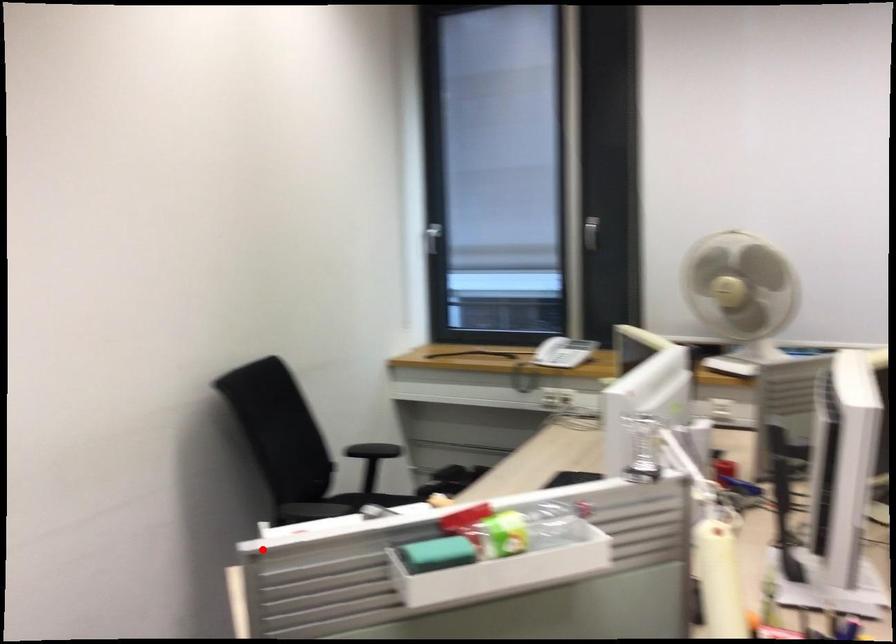
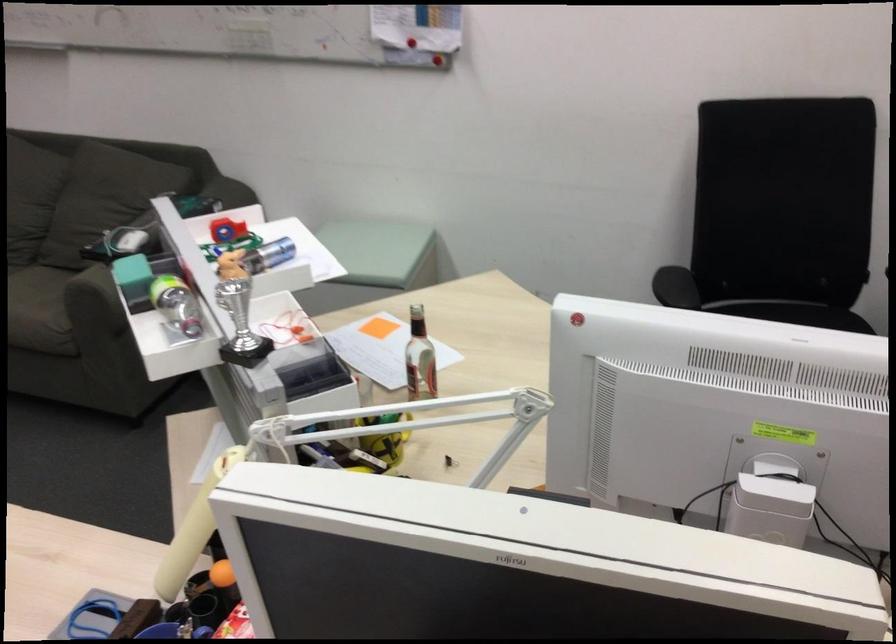
Find the pixel in the second image that matches the highlighted location in the first image.

(221, 230)